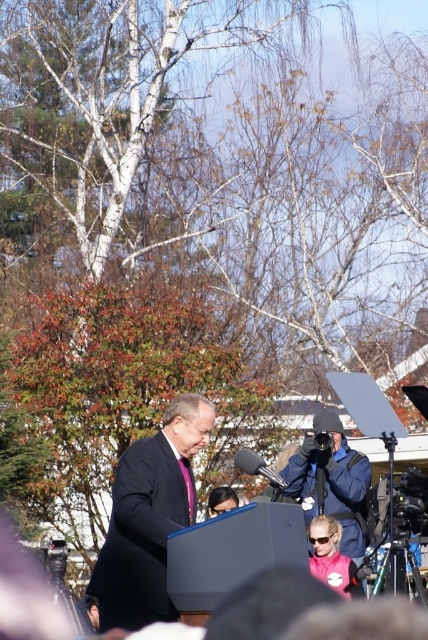
You are a photographer at the event and need to capture a clear photo of the speaker in the matte black suit at center. However, there is a matte black camera at center blocking your view. Can you adjust your position so that the camera no longer blocks the speaker?

The matte black suit at center is above the matte black camera at center, so if you lower your camera angle or position yourself lower, you can capture the speaker without the camera blocking the view.